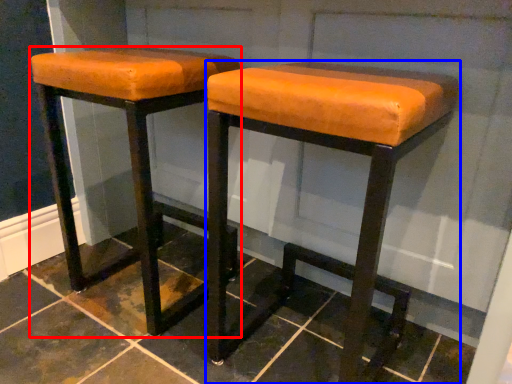
Question: Which object is further to the camera taking this photo, stool (highlighted by a red box) or stool (highlighted by a blue box)?

Choices:
 (A) stool
 (B) stool

Answer: (A)